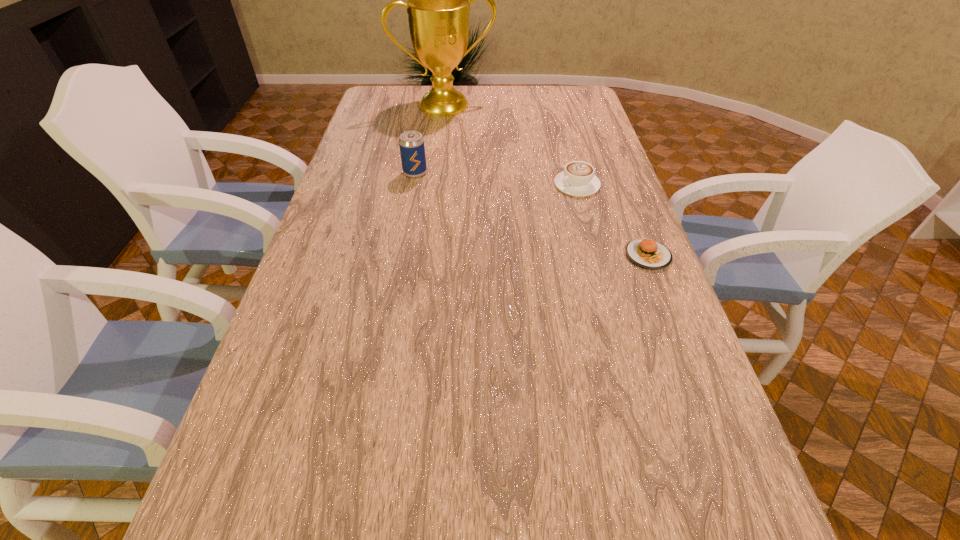
Locate an element on the screen. This screenshot has width=960, height=540. vacant spot on the desktop that is between the beer can and the rightmost object and is positioned on the shiny surface of the award is located at coordinates (504, 205).

Image resolution: width=960 pixels, height=540 pixels. In order to click on vacant space on the desktop that is between the second tallest object and the shortest object and is positioned with the handle on the right side of the third object from left to right in this screenshot , I will do `click(526, 212)`.